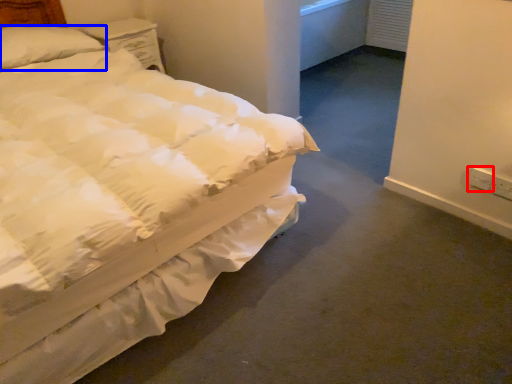
Question: Which of the following is the closest to the observer, electric outlet (highlighted by a red box) or pillow (highlighted by a blue box)?

Choices:
 (A) electric outlet
 (B) pillow

Answer: (A)